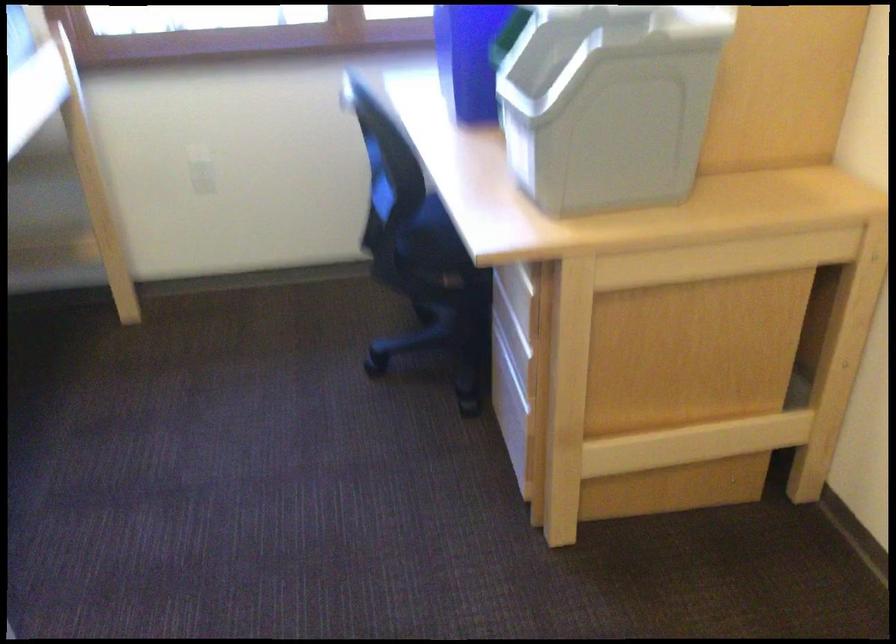
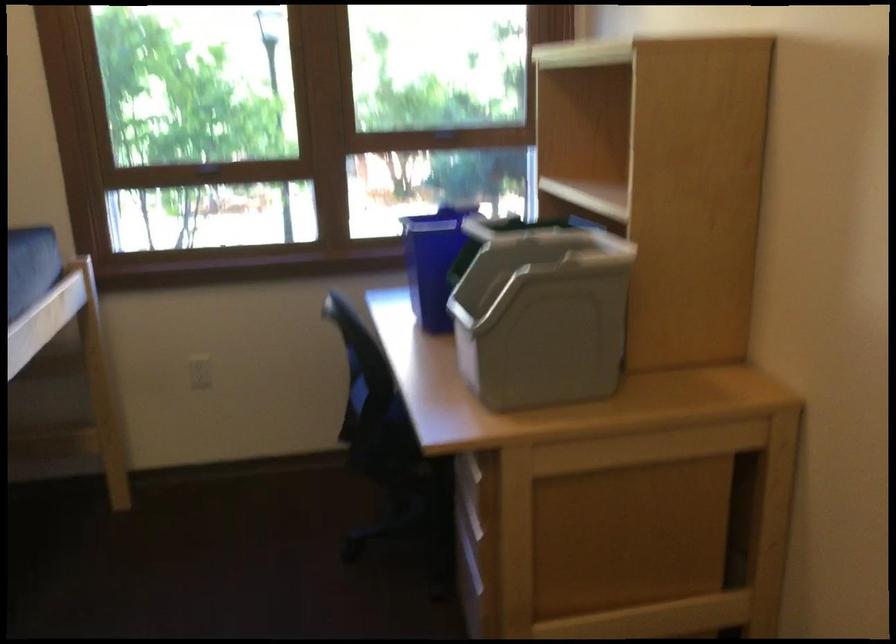
Find the pixel in the second image that matches (x=204, y=176) in the first image.

(200, 372)